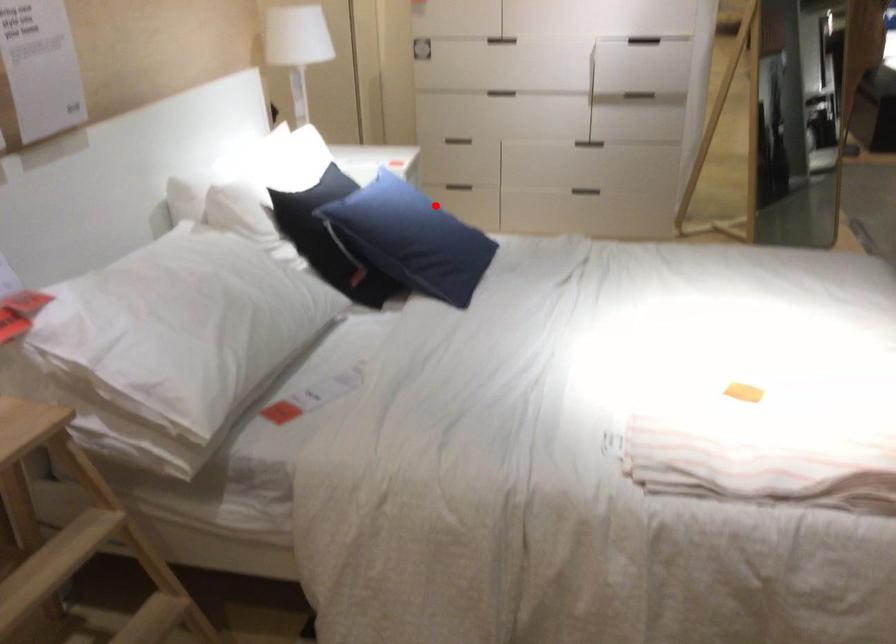
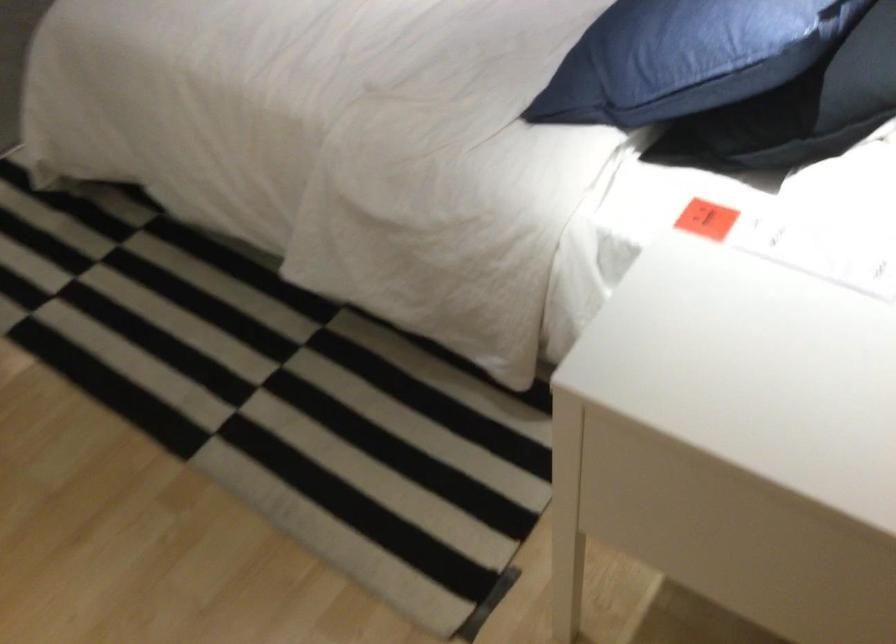
Find the pixel in the second image that matches the highlighted location in the first image.

(675, 58)